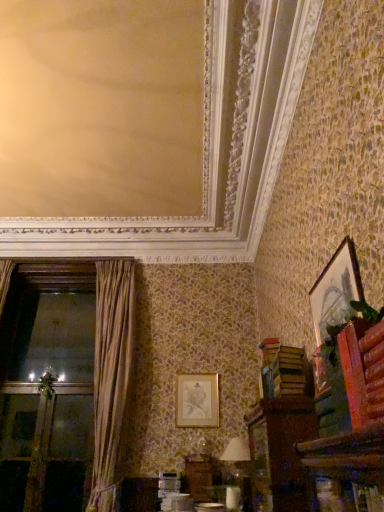
Describe the element at coordinates (345, 326) in the screenshot. I see `green leafy plant at upper right` at that location.

Image resolution: width=384 pixels, height=512 pixels. What are the coordinates of `transparent glass screen door at left` in the screenshot? It's located at (45, 449).

Locate an element on the screen. white fabric lampshade at lower center is located at coordinates (237, 474).

This screenshot has height=512, width=384. What do you see at coordinates (237, 474) in the screenshot?
I see `white fabric lampshade at lower center` at bounding box center [237, 474].

Where is `green leafy plant at upper right`? The width and height of the screenshot is (384, 512). green leafy plant at upper right is located at coordinates (345, 326).

Can you tell me how much green leafy plant at upper right and gold metallic picture frame at center, arranged as the second picture frame when viewed from the top, differ in facing direction?

The facing directions of green leafy plant at upper right and gold metallic picture frame at center, arranged as the second picture frame when viewed from the top, are 91.4 degrees apart.

Is green leafy plant at upper right taller or shorter than gold metallic picture frame at center, which appears as the 2th picture frame when viewed from the right?

In the image, green leafy plant at upper right appears to be shorter than gold metallic picture frame at center, which appears as the 2th picture frame when viewed from the right.

Which object is wider, green leafy plant at upper right or gold metallic picture frame at center, arranged as the second picture frame when viewed from the top?

green leafy plant at upper right is wider.

Is green leafy plant at upper right facing away from gold metallic picture frame at center, which appears as the 2th picture frame when viewed from the right?

No, green leafy plant at upper right's orientation is not away from gold metallic picture frame at center, which appears as the 2th picture frame when viewed from the right.

From a real-world perspective, between brown velvet curtain at left and brown wooden cabinet at lower right, who is vertically lower?

brown wooden cabinet at lower right is physically lower.

Is brown velvet curtain at left taller or shorter than brown wooden cabinet at lower right?

In the image, brown velvet curtain at left appears to be taller than brown wooden cabinet at lower right.

Would you consider brown velvet curtain at left to be distant from brown wooden cabinet at lower right?

brown velvet curtain at left is far away from brown wooden cabinet at lower right.

From the image's perspective, which object appears higher, gold-framed picture at upper right, positioned as the second picture frame in left-to-right order, or brown velvet curtain at left?

From the image's view, gold-framed picture at upper right, positioned as the second picture frame in left-to-right order, is above.

Is gold-framed picture at upper right, the 1th picture frame viewed from the right, bigger than brown velvet curtain at left?

Actually, gold-framed picture at upper right, the 1th picture frame viewed from the right, might be smaller than brown velvet curtain at left.

Is gold-framed picture at upper right, the 1th picture frame in the top-to-bottom sequence, oriented away from brown velvet curtain at left?

That's not correct — gold-framed picture at upper right, the 1th picture frame in the top-to-bottom sequence, is not looking away from brown velvet curtain at left.

Is the depth of brown wooden cabinet at lower right less than that of gold-framed picture at upper right, the second picture frame when ordered from back to front?

No, it is behind gold-framed picture at upper right, the second picture frame when ordered from back to front.

Is point (267, 490) farther from camera compared to point (335, 258)?

Yes, point (267, 490) is farther from viewer.

From the picture: Which object is thinner, brown wooden cabinet at lower right or gold-framed picture at upper right, positioned as the second picture frame in left-to-right order?

gold-framed picture at upper right, positioned as the second picture frame in left-to-right order.

From a real-world perspective, is brown wooden cabinet at lower right under gold-framed picture at upper right, which is the second picture frame from bottom to top?

Yes, from a real-world perspective, brown wooden cabinet at lower right is under gold-framed picture at upper right, which is the second picture frame from bottom to top.

Considering the positions of objects gold-framed picture at upper right, the 1th picture frame in the top-to-bottom sequence, and brown wooden cabinet at lower right in the image provided, who is behind, gold-framed picture at upper right, the 1th picture frame in the top-to-bottom sequence, or brown wooden cabinet at lower right?

brown wooden cabinet at lower right.

From the image's perspective, does gold-framed picture at upper right, which is the second picture frame from bottom to top, appear higher than brown wooden cabinet at lower right?

Correct, gold-framed picture at upper right, which is the second picture frame from bottom to top, appears higher than brown wooden cabinet at lower right in the image.

Is gold-framed picture at upper right, which is the 1th picture frame from front to back, directly adjacent to brown wooden cabinet at lower right?

No, gold-framed picture at upper right, which is the 1th picture frame from front to back, is not with brown wooden cabinet at lower right.

From a real-world perspective, is gold-framed picture at upper right, which is the second picture frame from bottom to top, beneath brown wooden cabinet at lower right?

No, from a real-world perspective, gold-framed picture at upper right, which is the second picture frame from bottom to top, is not below brown wooden cabinet at lower right.

This screenshot has height=512, width=384. What are the coordinates of `curtain above the brown wooden cabinet at lower right (from a real-world perspective)` in the screenshot? It's located at (111, 373).

What's the angular difference between brown wooden cabinet at lower right and brown velvet curtain at left's facing directions?

There is a 84.4-degree angle between the facing directions of brown wooden cabinet at lower right and brown velvet curtain at left.

Could you tell me if brown wooden cabinet at lower right is turned towards brown velvet curtain at left?

No.

Can you tell me how much brown wooden cabinet at lower right and transparent glass screen door at left differ in facing direction?

89.6 degrees separate the facing orientations of brown wooden cabinet at lower right and transparent glass screen door at left.

Where is `screen door located on the left of brown wooden cabinet at lower right`? This screenshot has height=512, width=384. screen door located on the left of brown wooden cabinet at lower right is located at coordinates (45, 449).

From the image's perspective, which is below, brown wooden cabinet at lower right or transparent glass screen door at left?

transparent glass screen door at left, from the image's perspective.

Are brown wooden cabinet at lower right and transparent glass screen door at left beside each other?

They are not placed beside each other.

Where is `picture frame lying on the left of green leafy plant at upper right`? Image resolution: width=384 pixels, height=512 pixels. picture frame lying on the left of green leafy plant at upper right is located at coordinates (197, 401).

Where is `curtain that is behind the brown wooden cabinet at lower right`? This screenshot has width=384, height=512. curtain that is behind the brown wooden cabinet at lower right is located at coordinates (111, 373).

From the image, which object appears to be nearer to transparent glass screen door at left, green leafy plant at upper right or brown wooden cabinet at lower right?

brown wooden cabinet at lower right is closer to transparent glass screen door at left.

Looking at the image, which one is located closer to transparent glass screen door at left, green leafy plant at upper right or gold metallic picture frame at center, the first picture frame from the left?

The object closer to transparent glass screen door at left is gold metallic picture frame at center, the first picture frame from the left.

When comparing their distances from brown wooden cabinet at lower right, does gold-framed picture at upper right, which is the 1th picture frame from front to back, or transparent glass screen door at left seem further?

transparent glass screen door at left is positioned further to the anchor brown wooden cabinet at lower right.

In the scene shown: Considering their positions, is transparent glass screen door at left positioned closer to gold-framed picture at upper right, positioned as the second picture frame in left-to-right order, than gold metallic picture frame at center, which ranks as the first picture frame in bottom-to-top order?

gold metallic picture frame at center, which ranks as the first picture frame in bottom-to-top order.

When comparing their distances from brown velvet curtain at left, does gold metallic picture frame at center, which is the second picture frame in front-to-back order, or gold-framed picture at upper right, which is the second picture frame from bottom to top, seem closer?

The object closer to brown velvet curtain at left is gold metallic picture frame at center, which is the second picture frame in front-to-back order.

Considering their positions, is green leafy plant at upper right positioned further to gold-framed picture at upper right, the 1th picture frame viewed from the right, than brown velvet curtain at left?

brown velvet curtain at left.

Estimate the real-world distances between objects in this image. Which object is further from green leafy plant at upper right, transparent glass screen door at left or brown velvet curtain at left?

Among the two, transparent glass screen door at left is located further to green leafy plant at upper right.

Estimate the real-world distances between objects in this image. Which object is closer to gold metallic picture frame at center, which appears as the 2th picture frame when viewed from the right, green leafy plant at upper right or brown wooden cabinet at lower right?

Among the two, brown wooden cabinet at lower right is located nearer to gold metallic picture frame at center, which appears as the 2th picture frame when viewed from the right.

This screenshot has height=512, width=384. In order to click on table lamp between gold-framed picture at upper right, the 1th picture frame viewed from the right, and transparent glass screen door at left in the front-back direction in this screenshot , I will do `click(237, 474)`.

At what (x,y) coordinates should I click in order to perform the action: click on curtain between brown wooden cabinet at lower right and gold metallic picture frame at center, arranged as the second picture frame when viewed from the top, along the z-axis. Please return your answer as a coordinate pair (x, y). The height and width of the screenshot is (512, 384). Looking at the image, I should click on (111, 373).

Locate an element on the screen. table lamp between green leafy plant at upper right and transparent glass screen door at left in the front-back direction is located at coordinates (237, 474).

Where is `curtain positioned between gold-framed picture at upper right, the 1th picture frame viewed from the right, and gold metallic picture frame at center, which is the second picture frame in front-to-back order, from near to far`? Image resolution: width=384 pixels, height=512 pixels. curtain positioned between gold-framed picture at upper right, the 1th picture frame viewed from the right, and gold metallic picture frame at center, which is the second picture frame in front-to-back order, from near to far is located at coordinates click(111, 373).